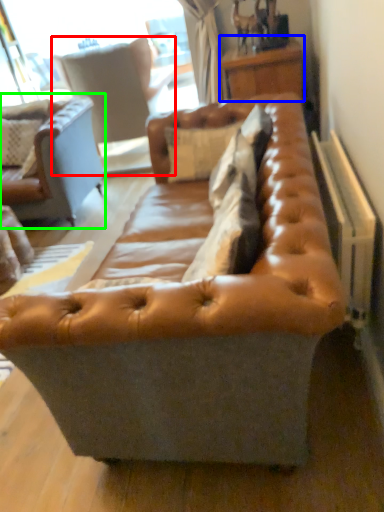
Question: Based on their relative distances, which object is nearer to swivel chair (highlighted by a red box)? Choose from table (highlighted by a blue box) and studio couch (highlighted by a green box).

Choices:
 (A) table
 (B) studio couch

Answer: (B)